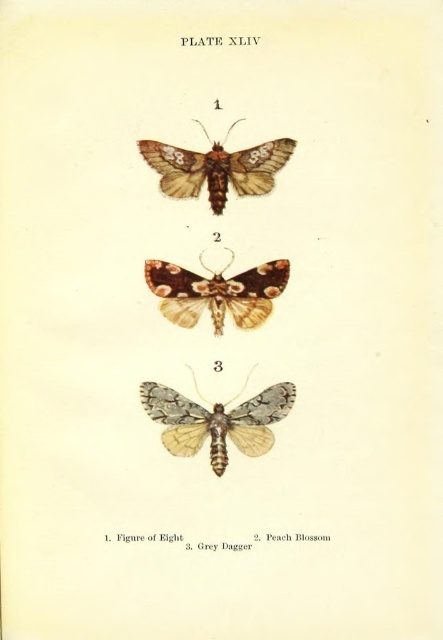
Question: Is speckled gray moth at center to the right of brown speckled moth at center from the viewer's perspective?

Choices:
 (A) no
 (B) yes

Answer: (A)

Question: Which object is the farthest from the brown speckled moth at center?

Choices:
 (A) brown textured moth at upper center
 (B) speckled gray moth at center

Answer: (B)

Question: Can you confirm if brown speckled moth at center is positioned below brown textured moth at upper center?

Choices:
 (A) no
 (B) yes

Answer: (B)

Question: Among these objects, which one is nearest to the camera?

Choices:
 (A) brown speckled moth at center
 (B) brown textured moth at upper center

Answer: (B)

Question: Is speckled gray moth at center to the right of brown speckled moth at center from the viewer's perspective?

Choices:
 (A) no
 (B) yes

Answer: (A)

Question: Among these points, which one is nearest to the camera?

Choices:
 (A) (255, 435)
 (B) (175, 179)
 (C) (272, 264)

Answer: (B)